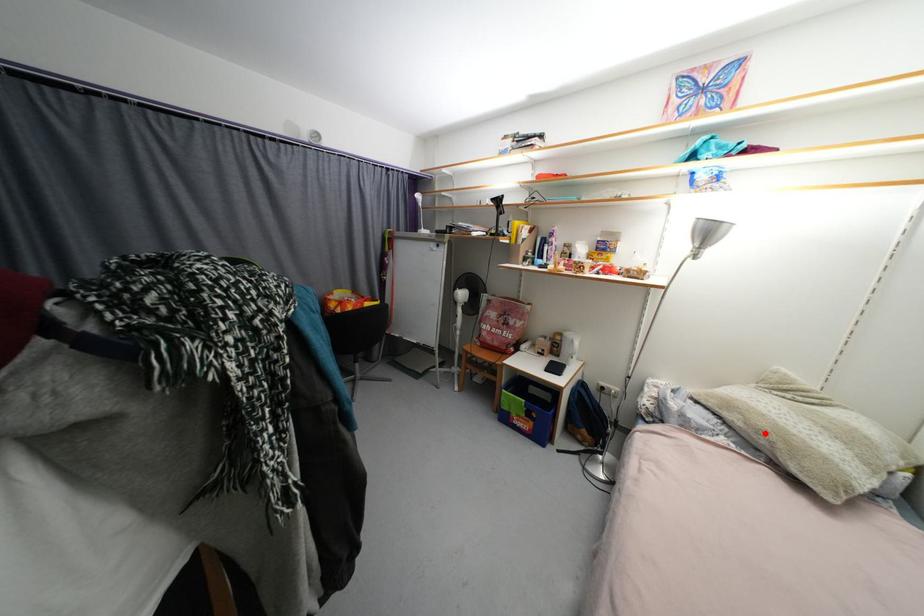
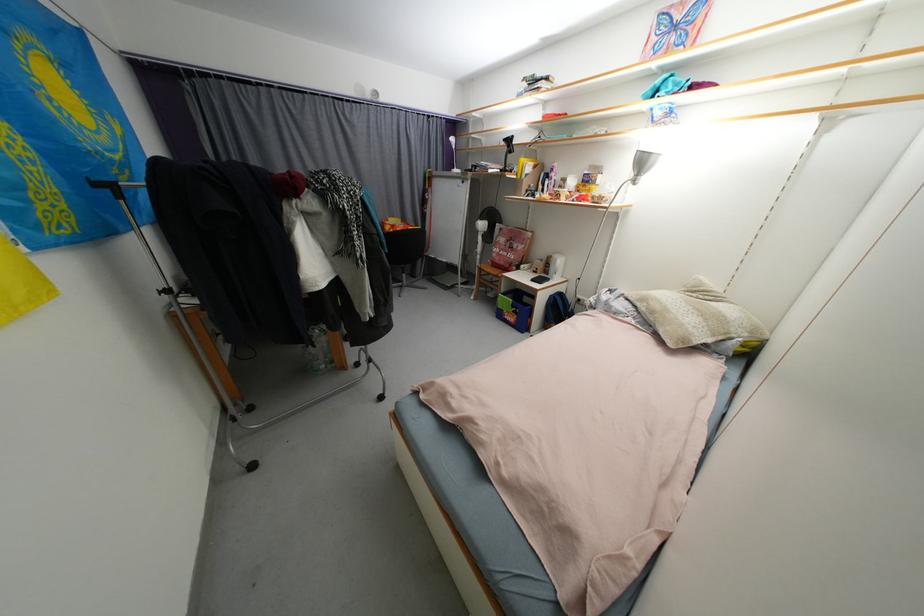
The point at the highlighted location is marked in the first image. Where is the corresponding point in the second image?

(658, 314)